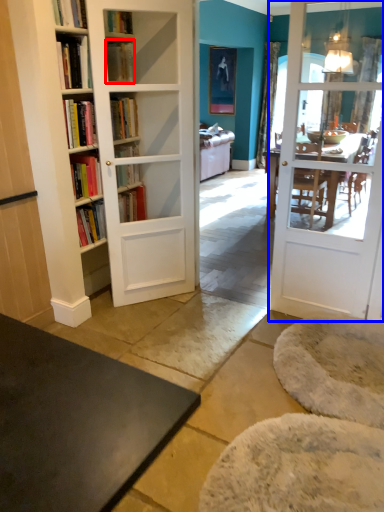
Question: Which of the following is the closest to the observer, book (highlighted by a red box) or door (highlighted by a blue box)?

Choices:
 (A) book
 (B) door

Answer: (B)